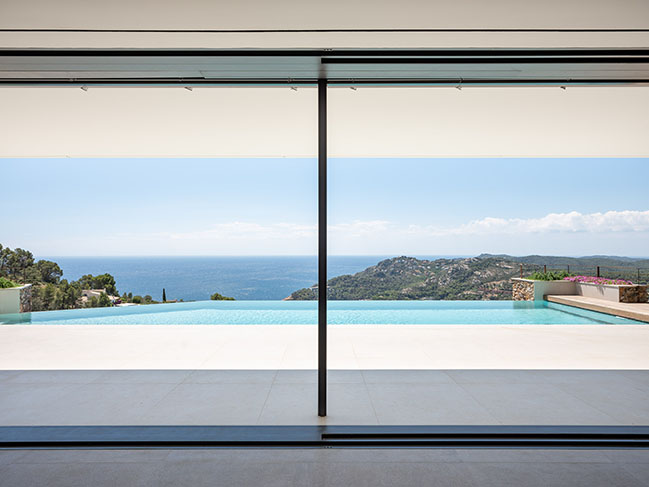
Where is `indoors`? indoors is located at coordinates (363, 470).